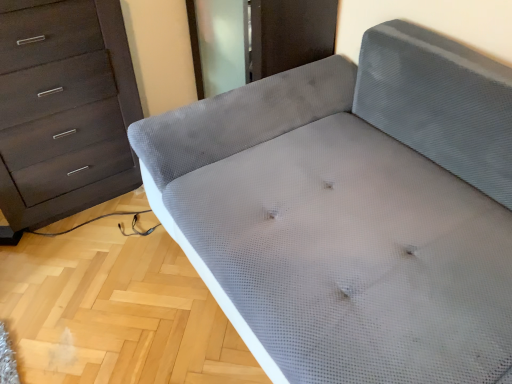
Question: Is gray fabric couch at center oriented away from matte dark brown chest of drawers at left?

Choices:
 (A) yes
 (B) no

Answer: (B)

Question: Is gray fabric couch at center not within matte dark brown chest of drawers at left?

Choices:
 (A) no
 (B) yes

Answer: (B)

Question: Considering the relative positions of gray fabric couch at center and matte dark brown chest of drawers at left in the image provided, is gray fabric couch at center in front of matte dark brown chest of drawers at left?

Choices:
 (A) yes
 (B) no

Answer: (A)

Question: Is gray fabric couch at center not close to matte dark brown chest of drawers at left?

Choices:
 (A) yes
 (B) no

Answer: (B)

Question: From the image's perspective, is gray fabric couch at center over matte dark brown chest of drawers at left?

Choices:
 (A) yes
 (B) no

Answer: (B)

Question: Does gray fabric couch at center lie behind matte dark brown chest of drawers at left?

Choices:
 (A) yes
 (B) no

Answer: (B)

Question: Does matte dark brown chest of drawers at left appear on the right side of gray fabric couch at center?

Choices:
 (A) yes
 (B) no

Answer: (B)

Question: Is matte dark brown chest of drawers at left far away from gray fabric couch at center?

Choices:
 (A) no
 (B) yes

Answer: (A)

Question: Is matte dark brown chest of drawers at left outside gray fabric couch at center?

Choices:
 (A) yes
 (B) no

Answer: (A)

Question: Can you confirm if matte dark brown chest of drawers at left is shorter than gray fabric couch at center?

Choices:
 (A) yes
 (B) no

Answer: (B)

Question: Considering the relative sizes of matte dark brown chest of drawers at left and gray fabric couch at center in the image provided, is matte dark brown chest of drawers at left wider than gray fabric couch at center?

Choices:
 (A) no
 (B) yes

Answer: (A)

Question: Is matte dark brown chest of drawers at left further to camera compared to gray fabric couch at center?

Choices:
 (A) yes
 (B) no

Answer: (A)

Question: Does point (42, 117) appear closer or farther from the camera than point (458, 286)?

Choices:
 (A) closer
 (B) farther

Answer: (B)